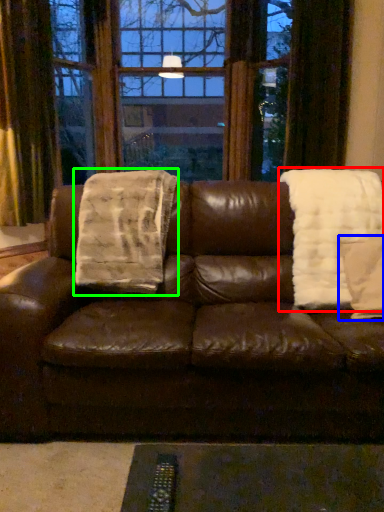
Question: Based on their relative distances, which object is farther from blanket (highlighted by a red box)? Choose from throw pillow (highlighted by a blue box) and blanket (highlighted by a green box).

Choices:
 (A) throw pillow
 (B) blanket

Answer: (B)